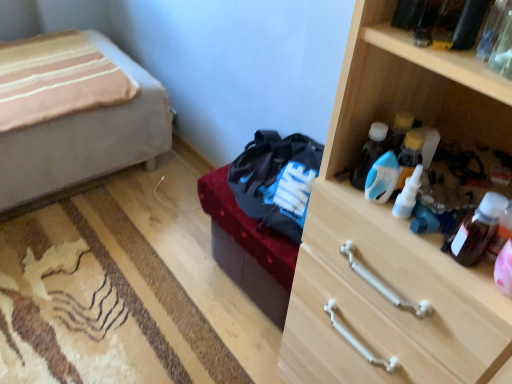
This screenshot has width=512, height=384. In order to click on vacant area situated to the left side of dark brown leather bed frame at center in this screenshot , I will do `click(188, 290)`.